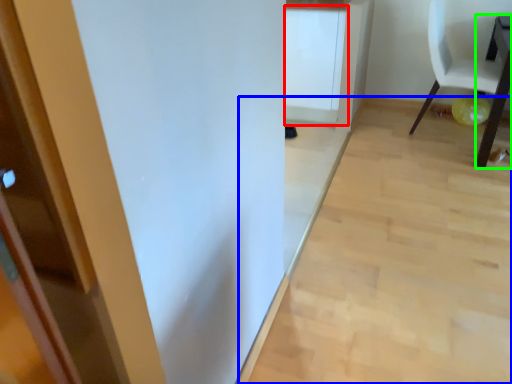
Question: Based on their relative distances, which object is farther from cabinetry (highlighted by a red box)? Choose from plain (highlighted by a blue box) and table (highlighted by a green box).

Choices:
 (A) plain
 (B) table

Answer: (B)